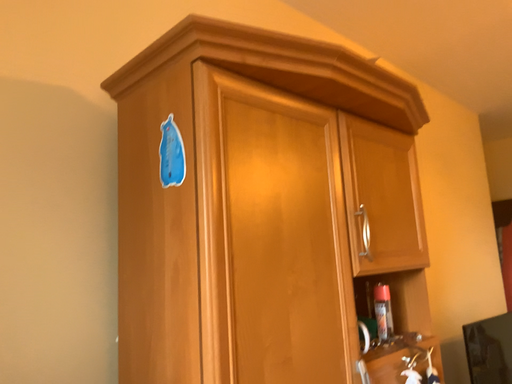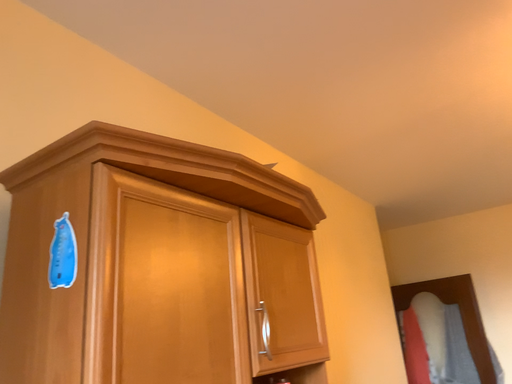
Question: How did the camera likely rotate when shooting the video?

Choices:
 (A) rotated downward
 (B) rotated upward

Answer: (B)